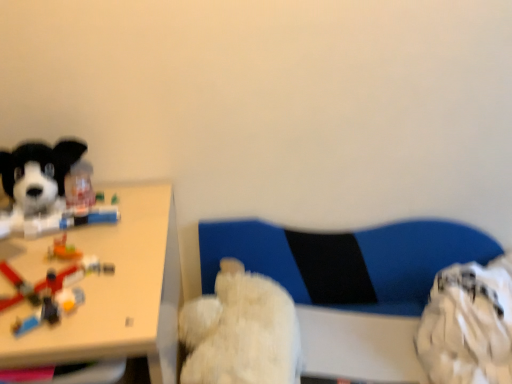
The image size is (512, 384). Identify the location of vacant space situated above blue fabric swivel chair at center (from a real-world perspective). (365, 206).